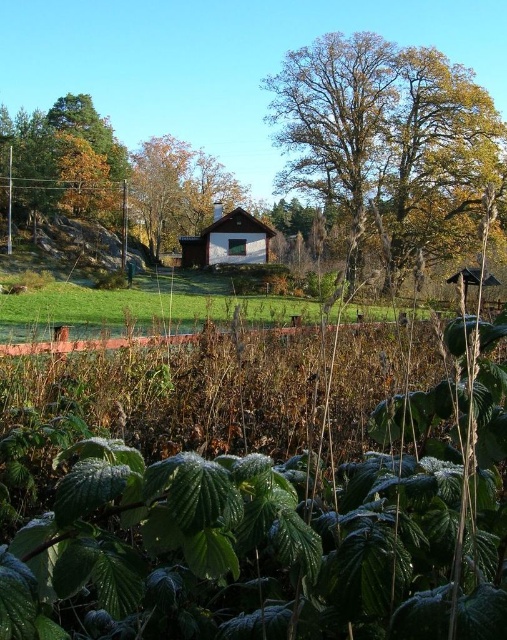
You are standing at the brown wood house at center and want to walk to the dense cluster of plants in the foreground. How far will you have to walk?

The distance between the brown wood house at center and the dense cluster of plants in the foreground is 47.44 meters, so you will have to walk 47.44 meters to reach them.

Based on the photo, you are a drone operator trying to capture the best aerial shot of the house. You have two points marked on your screen for camera positioning. The first point is at coordinates point (393, 68), and the second is at point (21, 122). Which point should you choose to get a closer view of the house?

Point (393, 68) is closer to the viewer than point (21, 122), so choosing the first point will provide a closer view of the house.